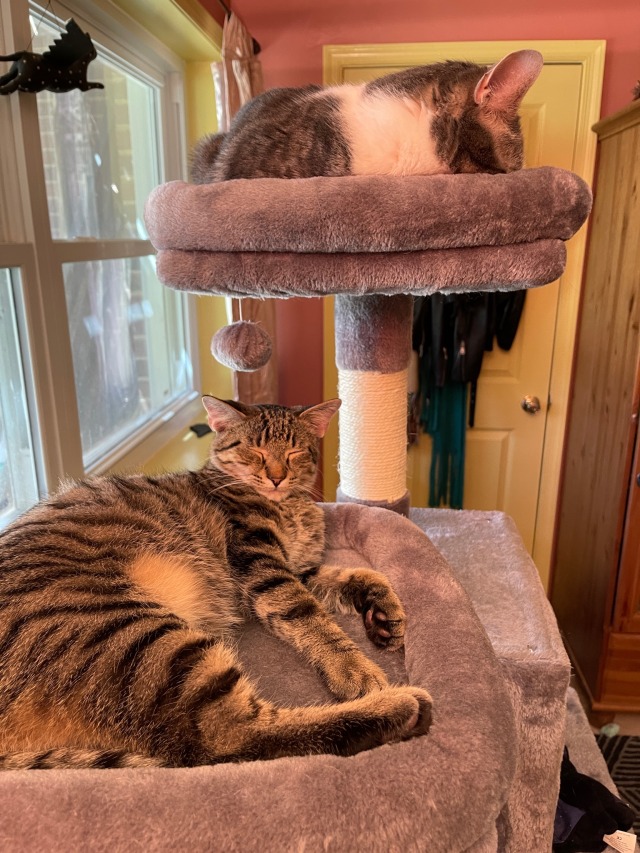
The image size is (640, 853). I want to click on window pane, so [9, 405], [115, 341], [97, 199].